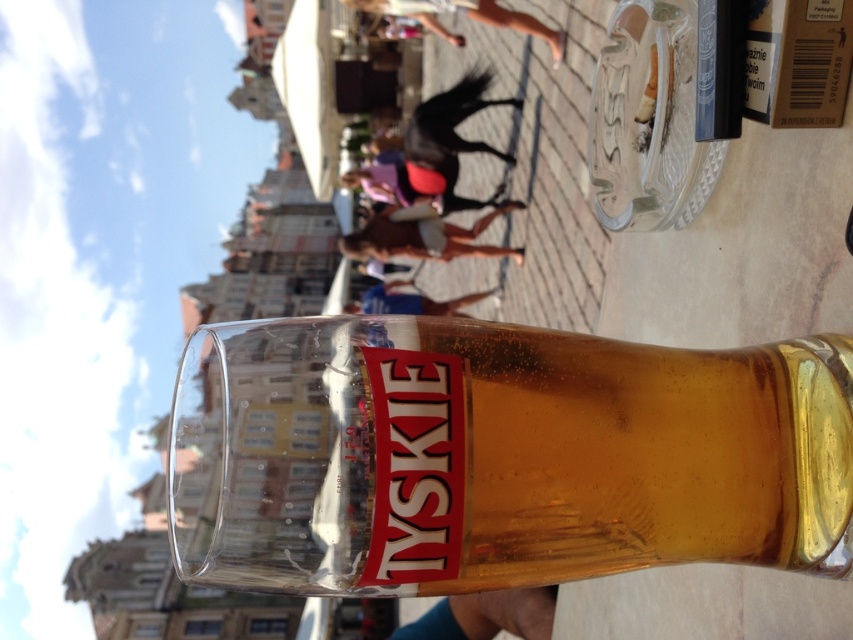
You are at a market and want to grab the translucent glass mug at center without knocking over the tan fabric shorts at center. Which one is taller so you know which to reach for first?

The translucent glass mug at center is taller than the tan fabric shorts at center, so you should reach for the translucent glass mug at center first to avoid knocking over the shorter object.

In the scene described, there is a point marked at coordinates (498,456). What object is located at this point?

The point at (498,456) marks the translucent glass mug at center.

You are a photographer trying to capture a closeup shot of the tan fabric shorts at center. Your camera has a minimum focusing distance of 12 inches. Will you be able to take the photo without moving closer?

The tan fabric shorts at center is 14.07 inches from the camera, which is beyond the minimum focusing distance of 12 inches. Therefore, you can take the photo without needing to move closer.